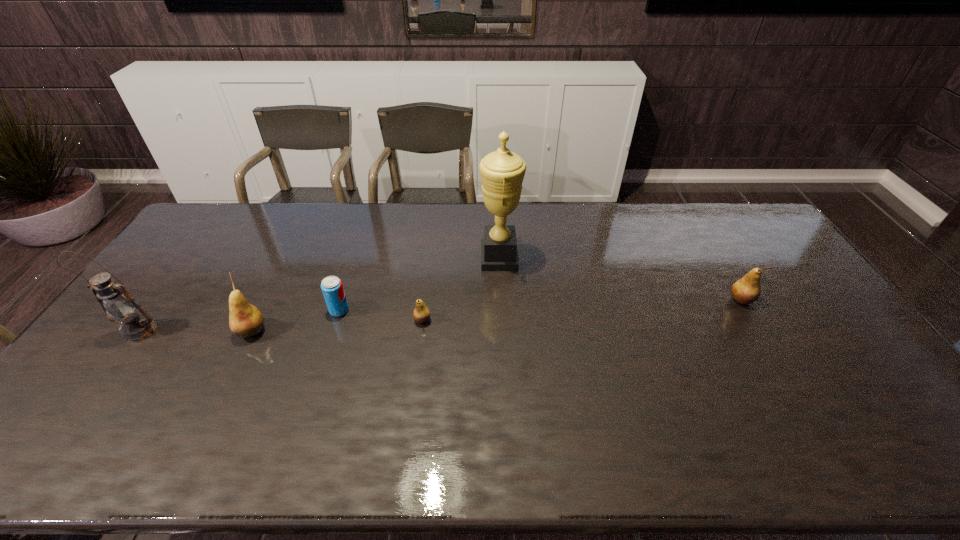
Find the location of a particular element. The height and width of the screenshot is (540, 960). vacant space at the far edge is located at coordinates (559, 236).

The width and height of the screenshot is (960, 540). I want to click on vacant space at the near edge of the desktop, so click(x=231, y=401).

Locate an element on the screen. This screenshot has width=960, height=540. vacant space at the right edge of the desktop is located at coordinates (750, 269).

Where is `vacant space at the near right corner of the desktop`? vacant space at the near right corner of the desktop is located at coordinates (849, 397).

Find the location of a particular element. free space between the second tallest object and the tallest object is located at coordinates (320, 294).

Identify the location of vacant area between the second object from left to right and the rightmost object. coord(496,315).

Where is `empty location between the trophy cup and the leftmost object`? The height and width of the screenshot is (540, 960). empty location between the trophy cup and the leftmost object is located at coordinates (320, 294).

This screenshot has width=960, height=540. I want to click on blank region between the second pear from right to left and the fifth object from right to left, so click(x=337, y=326).

Where is `empty location between the tallest object and the fourth tallest object`? This screenshot has width=960, height=540. empty location between the tallest object and the fourth tallest object is located at coordinates (620, 279).

The height and width of the screenshot is (540, 960). What are the coordinates of `unoccupied area between the fourth object from right to left and the leftmost pear` in the screenshot? It's located at (296, 321).